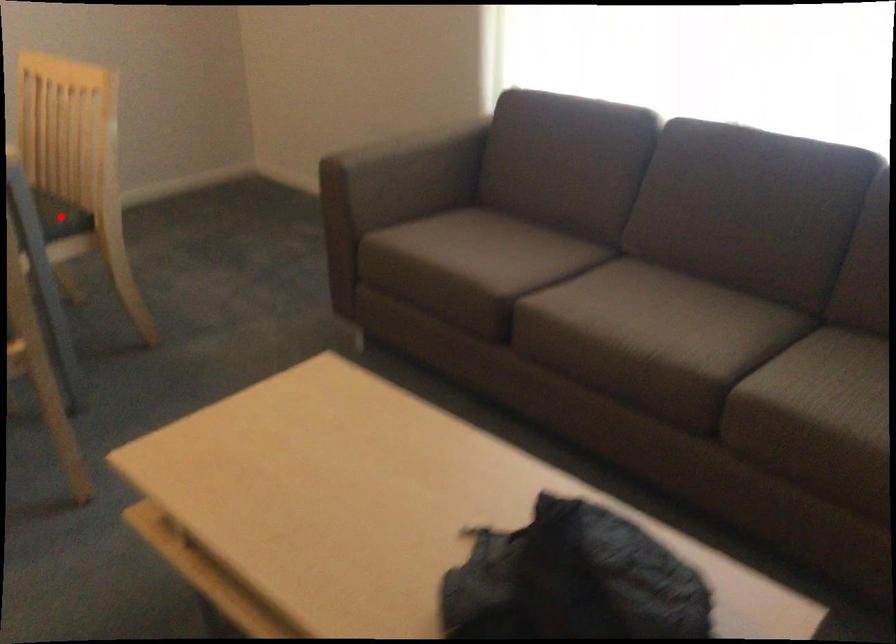
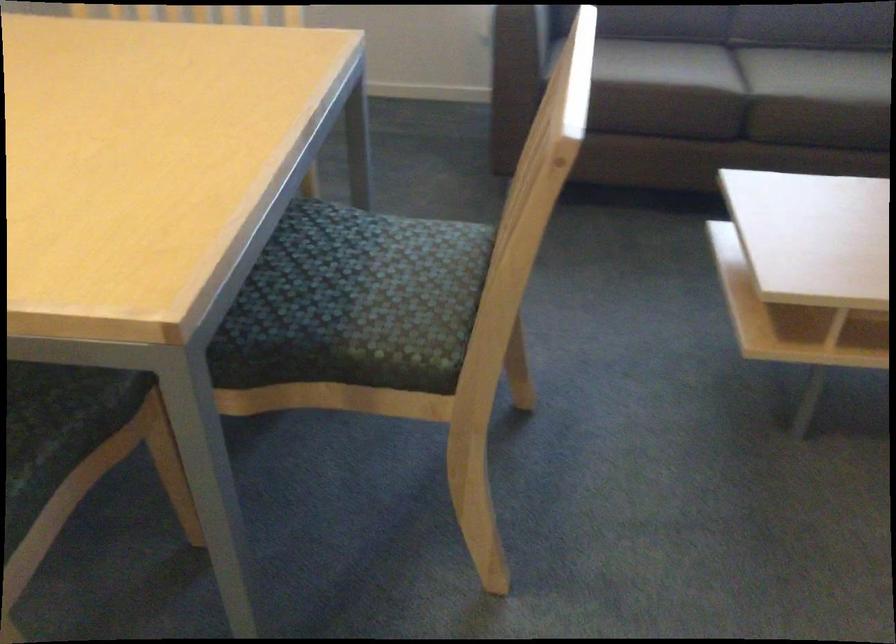
Question: I am providing you with two images of the same scene from different viewpoints. A red point is marked on the first image. At the location where the point appears in image 1, is it still visible in image 2?

Choices:
 (A) Yes
 (B) No

Answer: (B)